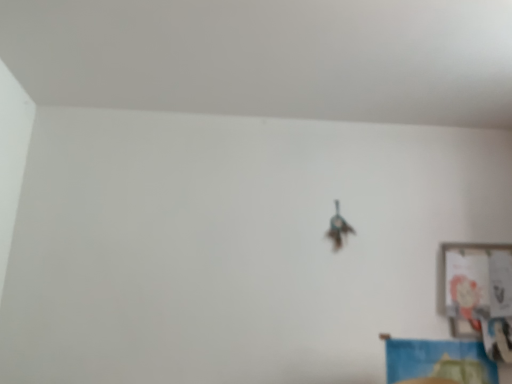
What do you see at coordinates (465, 284) in the screenshot?
I see `matte plastic picture frame at lower right` at bounding box center [465, 284].

Locate an element on the screen. matte plastic picture frame at lower right is located at coordinates (465, 284).

Based on the photo, measure the distance between point (448, 314) and camera.

6.50 feet.

This screenshot has height=384, width=512. I want to click on matte plastic picture frame at lower right, so click(x=465, y=284).